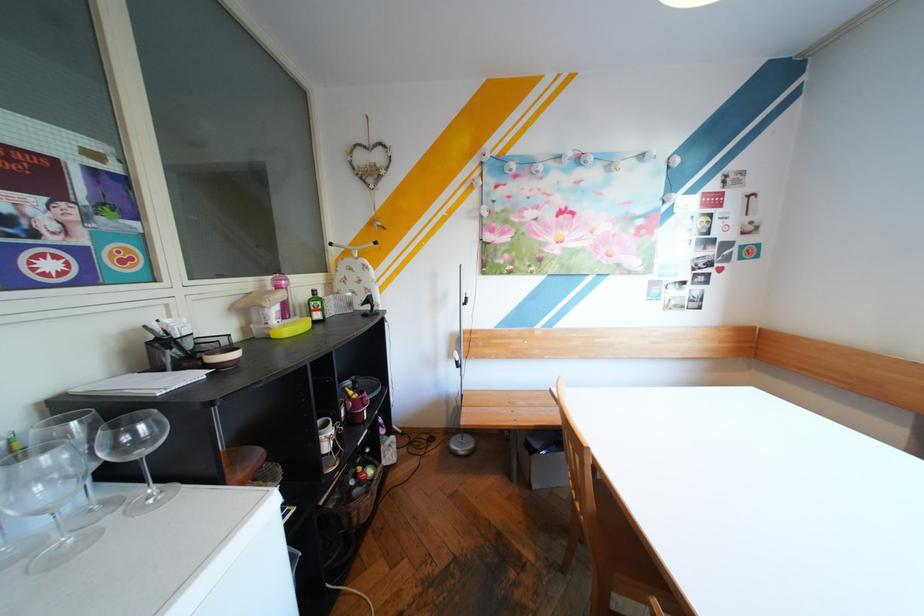
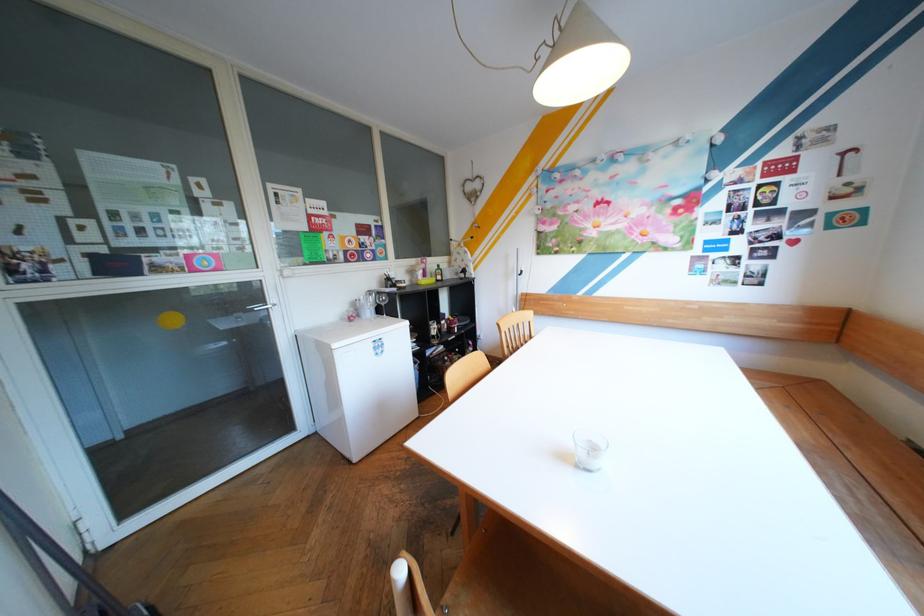
The point at (289,307) is marked in the first image. Where is the corresponding point in the second image?

(434, 270)